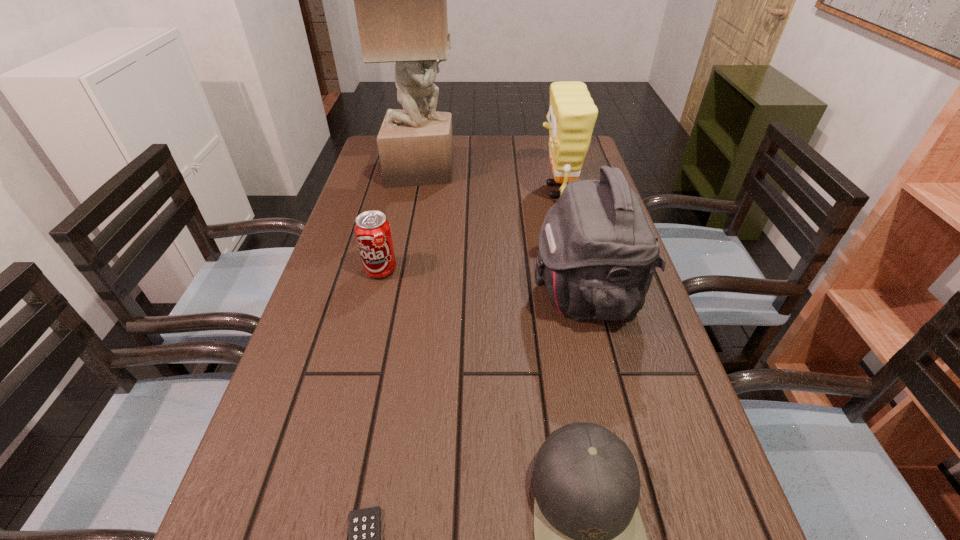
At what (x,y) coordinates should I click in order to perform the action: click on free location at the right edge. Please return your answer as a coordinate pair (x, y). Looking at the image, I should click on (647, 305).

What are the coordinates of `free space at the far left corner of the desktop` in the screenshot? It's located at (368, 165).

At what (x,y) coordinates should I click in order to perform the action: click on vacant area that lies between the sponge and the tallest object. Please return your answer as a coordinate pair (x, y). Image resolution: width=960 pixels, height=540 pixels. Looking at the image, I should click on (490, 181).

Locate an element on the screen. Image resolution: width=960 pixels, height=540 pixels. unoccupied position between the fourth tallest object and the shoulder bag is located at coordinates (483, 281).

Identify the location of vacant space in between the third shortest object and the shoulder bag. (483, 281).

Locate an element on the screen. This screenshot has width=960, height=540. blank region between the soda and the shoulder bag is located at coordinates (483, 281).

Where is `free area in between the third shortest object and the sculpture`? free area in between the third shortest object and the sculpture is located at coordinates (401, 221).

The height and width of the screenshot is (540, 960). I want to click on blank region between the tallest object and the soda, so click(401, 221).

This screenshot has height=540, width=960. In order to click on object that stands as the second closest to the fifth tallest object in this screenshot , I will do pyautogui.click(x=597, y=253).

Select which object appears as the fifth closest to the sculpture. Please provide its 2D coordinates. Your answer should be formatted as a tuple, i.e. [(x, y)], where the tuple contains the x and y coordinates of a point satisfying the conditions above.

[(364, 534)]